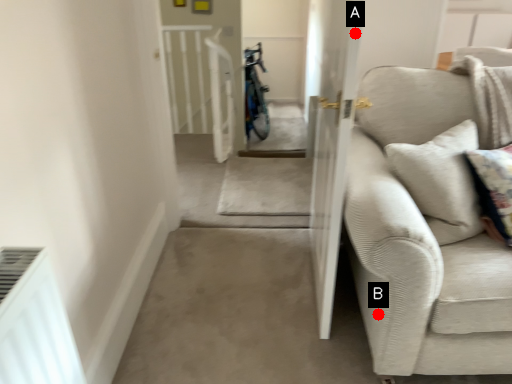
Question: Two points are circled on the image, labeled by A and B beside each circle. Which point appears closest to the camera in this image?

Choices:
 (A) A is closer
 (B) B is closer

Answer: (A)